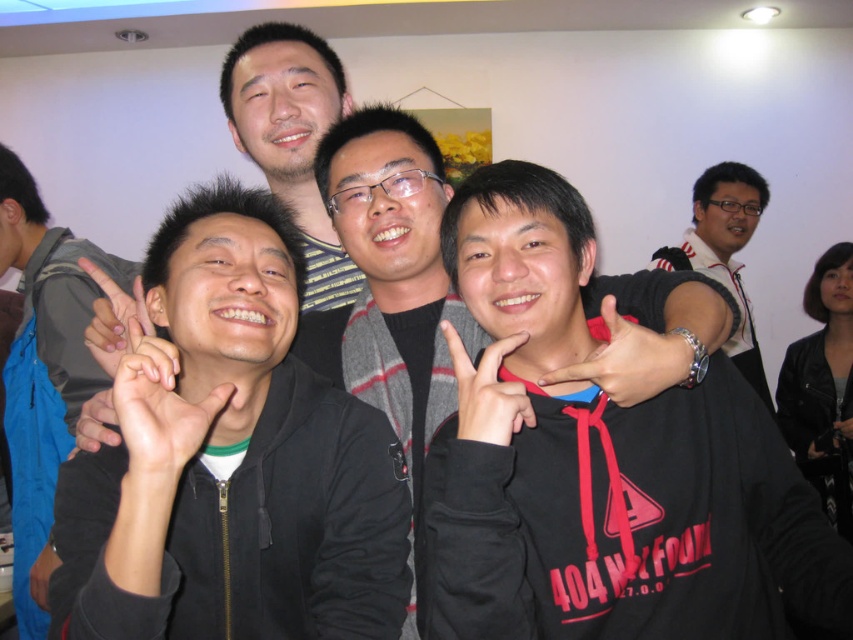
You are a photographer at the event and want to ensure that both the black matte jacket at left and the black matte hand at lower left are clearly visible in the photo. Based on their positions, which one should you focus on first to ensure depth of field captures both?

The black matte jacket at left is located above the black matte hand at lower left, so focusing on the jacket first will help ensure both are in focus since it is closer to the background.

You are standing in front of the image and want to locate the black matte jacket at left. Where exactly is it positioned in the image?

The black matte jacket at left is positioned at point coordinates of 0.570 on the x axis and 0.052 on the y axis.